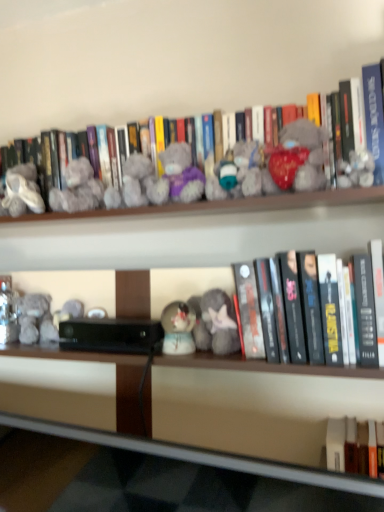
Question: Is matte gray plush at center, positioned as the 2th toy in right-to-left order, inside the boundaries of fluffy gray plush at center, which appears as the fourth toy when viewed from the right, or outside?

Choices:
 (A) outside
 (B) inside

Answer: (A)

Question: Would you say matte gray plush at center, positioned as the sixth toy in left-to-right order, is to the left or to the right of fluffy gray plush at center, which appears as the fourth toy when viewed from the right, in the picture?

Choices:
 (A) right
 (B) left

Answer: (A)

Question: Estimate the real-world distances between objects in this image. Which object is farther from the fluffy gray plush at center, which ranks as the fourth toy in left-to-right order?

Choices:
 (A) white fabric ballet shoes at left, the first toy viewed from the left
 (B) black matte book at center, which appears as the 1th book when ordered from the bottom
 (C) fuzzy fabric teddy bear at center, which is the third toy from left to right
 (D) gray plush bear at upper left, which is the second toy from left to right
 (E) matte purple plush at center, which is the 3th toy in right-to-left order

Answer: (A)

Question: Estimate the real-world distances between objects in this image. Which object is closer to the fluffy gray plush at center, which ranks as the fourth toy in left-to-right order?

Choices:
 (A) gray plush bear at upper left, which ranks as the sixth toy in right-to-left order
 (B) fuzzy fabric teddy bear at center, the 5th toy viewed from the right
 (C) white fabric ballet shoes at left, the first toy viewed from the left
 (D) matte purple plush at center, which is the 3th toy in right-to-left order
 (E) wooden at lower center

Answer: (E)